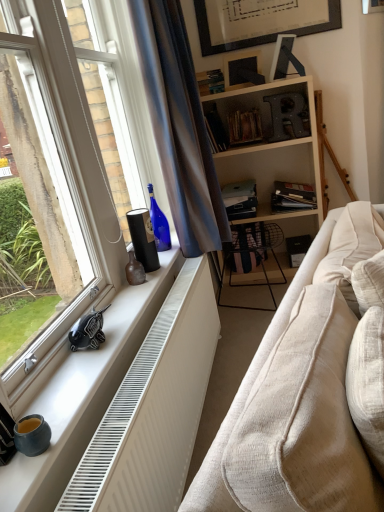
Question: From the image's perspective, is brown matte vase at window sill positioned above or below hardcover book at center, the fourth book from the bottom?

Choices:
 (A) above
 (B) below

Answer: (B)

Question: From a real-world perspective, relative to hardcover book at center, which appears as the 2th book when viewed from the top, is brown matte vase at window sill vertically above or below?

Choices:
 (A) below
 (B) above

Answer: (A)

Question: Which object is the closest to the hardcover book at upper center, which is counted as the first book, starting from the top?

Choices:
 (A) black matte book at center, the second book when ordered from bottom to top
 (B) satin blue curtain at window
 (C) wooden picture frame at upper center
 (D) matte black bookshelf at center, which is counted as the 5th book, starting from the top
 (E) hardcover book at center, arranged as the third book when viewed from the top

Answer: (C)

Question: Considering the real-world distances, which object is closest to the hardcover book at upper center, which is counted as the first book, starting from the top?

Choices:
 (A) brown matte vase at window sill
 (B) beige fabric couch at lower right
 (C) hardcover book at center, marked as the third book in a bottom-to-top arrangement
 (D) matte black bookshelf at center, which is counted as the 5th book, starting from the top
 (E) hardcover book at center, which appears as the 2th book when viewed from the top

Answer: (E)